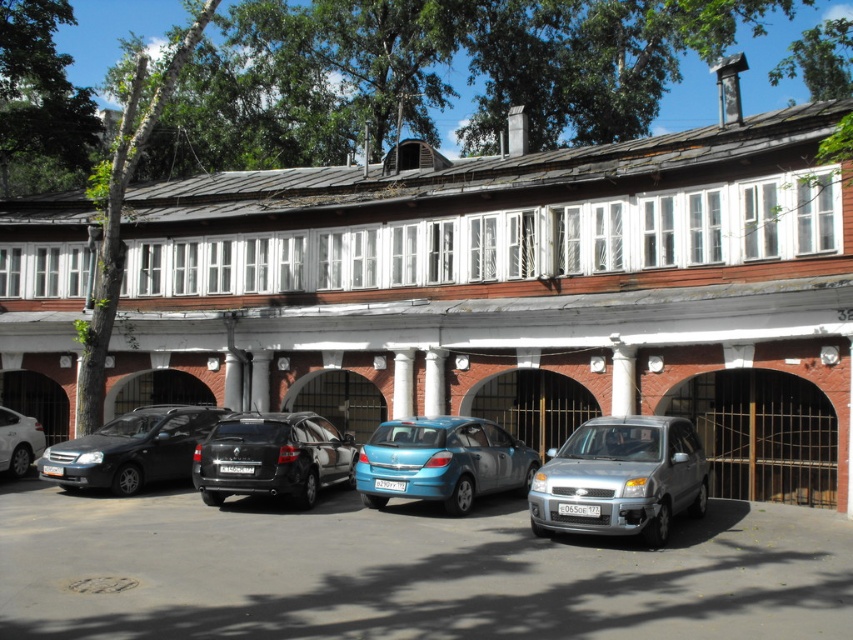
You are a delivery driver who needs to park your truck between the blue metallic hatchback at center and the white marble column at center. Can you fit your truck there if your truck is 6 meters long?

The blue metallic hatchback at center is located below the white marble column at center, but the exact distance between them isn t specified. Without knowing the space between the hatchback and the column, it s impossible to determine if the truck will fit.

You are a delivery person trying to park a 2.5 meter wide delivery van between the black glossy hatchback at center and the shiny black sedan at center. Can you fit your van between them?

The distance between the black glossy hatchback at center and the shiny black sedan at center is 3.21 meters. Since your van is 2.5 meters wide, you can fit it between them as there is enough space.

You are a delivery person trying to park your van between the silver metallic hatchback at center and the shiny silver sedan at left. Can your van, which is 5 meters long, fit in the space between them?

The silver metallic hatchback at center is larger than the shiny silver sedan at left, but the description does not provide the exact distance between them. Therefore, it is impossible to determine if the van will fit without additional information about the spacing between the two vehicles.